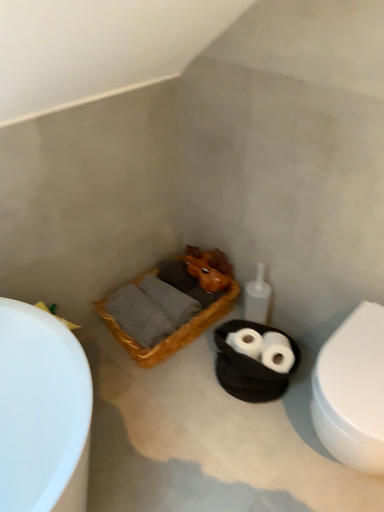
What is the approximate height of white glossy bathtub at left?

41.22 centimeters.

Measure the distance between point [257,380] and camera.

The depth of point [257,380] is 5.10 feet.

Measure the distance between black woven basket at center and camera.

They are 1.50 meters apart.

Describe the element at coordinates (246, 342) in the screenshot. The image size is (384, 512). I see `white matte toilet paper at center` at that location.

Locate an element on the screen. white glossy toilet at right is located at coordinates (352, 390).

In order to click on white glossy bathtub at left in this screenshot , I will do `click(42, 412)`.

How many degrees apart are the facing directions of black woven basket at center and white glossy toilet at right?

28 degrees separate the facing orientations of black woven basket at center and white glossy toilet at right.

Is black woven basket at center shorter than white glossy toilet at right?

Indeed, black woven basket at center has a lesser height compared to white glossy toilet at right.

From the image's perspective, which object appears higher, black woven basket at center or white glossy toilet at right?

From the image's view, black woven basket at center is above.

Is black woven basket at center closer to the viewer compared to white glossy toilet at right?

No, black woven basket at center is further to the viewer.

Can you confirm if white glossy toilet at right is thinner than black woven basket at center?

No, white glossy toilet at right is not thinner than black woven basket at center.

From the image's perspective, which one is positioned lower, white glossy toilet at right or black woven basket at center?

white glossy toilet at right.

Considering the relative positions of white glossy toilet at right and black woven basket at center in the image provided, is white glossy toilet at right to the left or to the right of black woven basket at center?

In the image, white glossy toilet at right appears on the right side of black woven basket at center.

Are white glossy toilet at right and black woven basket at center located far from each other?

Actually, white glossy toilet at right and black woven basket at center are a little close together.

Considering the relative positions of white glossy bathtub at left and woven wood basket at center in the image provided, is white glossy bathtub at left to the left of woven wood basket at center from the viewer's perspective?

Yes, white glossy bathtub at left is to the left of woven wood basket at center.

Looking at this image, does white glossy bathtub at left have a smaller size compared to woven wood basket at center?

Indeed, white glossy bathtub at left has a smaller size compared to woven wood basket at center.

Is white glossy bathtub at left far from woven wood basket at center?

They are positioned close to each other.

Based on the photo, how different are the orientations of white glossy bathtub at left and woven wood basket at center in degrees?

90.4 degrees.

Does white glossy bathtub at left lie behind white matte toilet paper at center?

No, the depth of white glossy bathtub at left is less than that of white matte toilet paper at center.

In the image, is white glossy bathtub at left on the left side or the right side of white matte toilet paper at center?

white glossy bathtub at left is positioned on white matte toilet paper at center's left side.

Which object is thinner, white glossy bathtub at left or white matte toilet paper at center?

white matte toilet paper at center.

Is white glossy bathtub at left aimed at white matte toilet paper at center?

No, white glossy bathtub at left is not aimed at white matte toilet paper at center.

From a real-world perspective, is black woven basket at center beneath woven wood basket at center?

Yes, from a real-world perspective, black woven basket at center is under woven wood basket at center.

Considering the points (217, 346) and (124, 337), which point is in front, point (217, 346) or point (124, 337)?

The point (217, 346) is closer.

Is there a large distance between black woven basket at center and woven wood basket at center?

No, black woven basket at center is not far from woven wood basket at center.

From the image's perspective, would you say white matte toilet paper at center is positioned over white glossy toilet at right?

Yes, from the image's perspective, white matte toilet paper at center is above white glossy toilet at right.

From a real-world perspective, who is located lower, white matte toilet paper at center or white glossy toilet at right?

From a 3D spatial view, white matte toilet paper at center is below.

Can you confirm if white matte toilet paper at center is shorter than white glossy toilet at right?

Yes.

From a real-world perspective, is woven wood basket at center located beneath white matte toilet paper at center?

Yes, from a real-world perspective, woven wood basket at center is below white matte toilet paper at center.

Image resolution: width=384 pixels, height=512 pixels. Find the location of `toilet paper in front of the woven wood basket at center`. toilet paper in front of the woven wood basket at center is located at coordinates (246, 342).

Can you tell me how much woven wood basket at center and white matte toilet paper at center differ in facing direction?

30.7 degrees separate the facing orientations of woven wood basket at center and white matte toilet paper at center.

Is woven wood basket at center positioned beyond the bounds of white matte toilet paper at center?

That's correct, woven wood basket at center is outside of white matte toilet paper at center.

What are the coordinates of `toilet on the right of black woven basket at center` in the screenshot? It's located at (352, 390).

In the image, there is a white glossy toilet at right. Identify the location of basket container above it (from the image's perspective). (245, 368).

When comparing their distances from woven wood basket at center, does white glossy toilet at right or white matte toilet paper at center seem further?

white glossy toilet at right.

From the image, which object appears to be nearer to woven wood basket at center, black woven basket at center or white glossy toilet at right?

black woven basket at center lies closer to woven wood basket at center than the other object.

Looking at the image, which one is located closer to woven wood basket at center, white glossy bathtub at left or white matte toilet paper at center?

The object closer to woven wood basket at center is white matte toilet paper at center.

From the image, which object appears to be nearer to white glossy toilet at right, black woven basket at center or woven wood basket at center?

black woven basket at center lies closer to white glossy toilet at right than the other object.

From the image, which object appears to be farther from white glossy bathtub at left, woven wood basket at center or white glossy toilet at right?

The object further to white glossy bathtub at left is white glossy toilet at right.

Considering their positions, is white matte toilet paper at center positioned further to woven wood basket at center than white glossy toilet at right?

Among the two, white glossy toilet at right is located further to woven wood basket at center.

Looking at the image, which one is located further to white glossy bathtub at left, white matte toilet paper at center or black woven basket at center?

Based on the image, white matte toilet paper at center appears to be further to white glossy bathtub at left.

Considering their positions, is woven wood basket at center positioned closer to white glossy toilet at right than white matte toilet paper at center?

white matte toilet paper at center lies closer to white glossy toilet at right than the other object.

Find the location of a particular element. The width and height of the screenshot is (384, 512). toilet paper between woven wood basket at center and black woven basket at center in the horizontal direction is located at coordinates (246, 342).

The image size is (384, 512). I want to click on toilet paper between white glossy bathtub at left and white glossy toilet at right, so click(x=246, y=342).

You are a GUI agent. You are given a task and a screenshot of the screen. Output one action in this format:
    pyautogui.click(x=<x>, y=<y>)
    Task: Click on the basket situated between white glossy bathtub at left and black woven basket at center from left to right
    This screenshot has height=512, width=384.
    Given the screenshot: What is the action you would take?
    pyautogui.click(x=173, y=333)

Locate an element on the screen. The image size is (384, 512). toilet paper between white glossy bathtub at left and black woven basket at center in the horizontal direction is located at coordinates (246, 342).